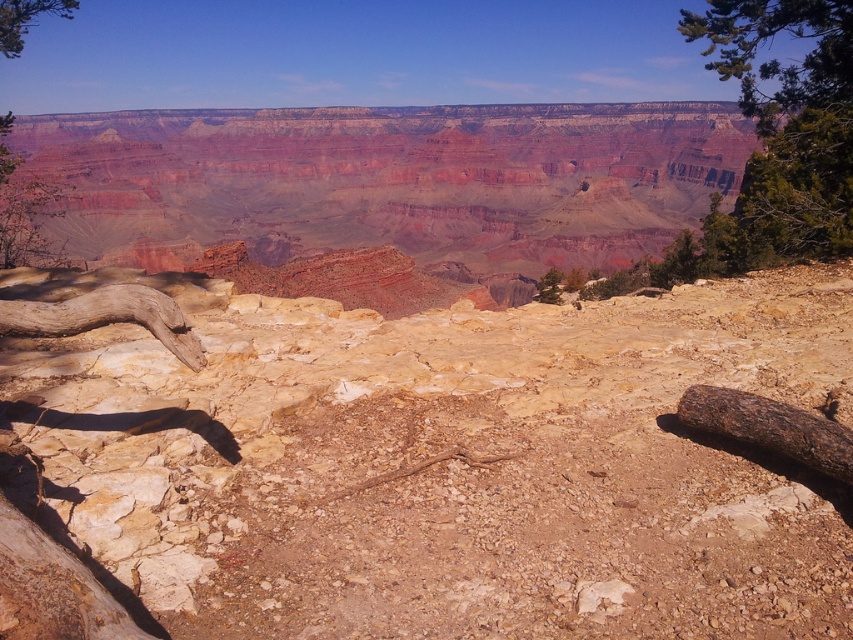
Which is behind, point (152, 321) or point (18, 29)?

The point (18, 29) is more distant.

Is brown rough tree trunk at left positioned behind green leafy tree at upper left?

No, it is not.

Does point (113, 300) come closer to viewer compared to point (15, 35)?

That is True.

Find the location of a particular element. The height and width of the screenshot is (640, 853). brown rough tree trunk at left is located at coordinates (106, 317).

What do you see at coordinates (787, 124) in the screenshot?
I see `green textured pine tree at upper right` at bounding box center [787, 124].

Does green textured pine tree at upper right appear on the left side of green leafy tree at upper left?

In fact, green textured pine tree at upper right is to the right of green leafy tree at upper left.

Which is behind, point (799, 67) or point (51, 8)?

The point (51, 8) is more distant.

This screenshot has height=640, width=853. In order to click on green textured pine tree at upper right in this screenshot , I will do `click(787, 124)`.

Which is above, green textured pine tree at upper right or brown rough tree trunk at left?

green textured pine tree at upper right is above.

Who is more distant from viewer, (795, 145) or (175, 324)?

Point (795, 145)

This screenshot has width=853, height=640. Find the location of `green textured pine tree at upper right`. green textured pine tree at upper right is located at coordinates (787, 124).